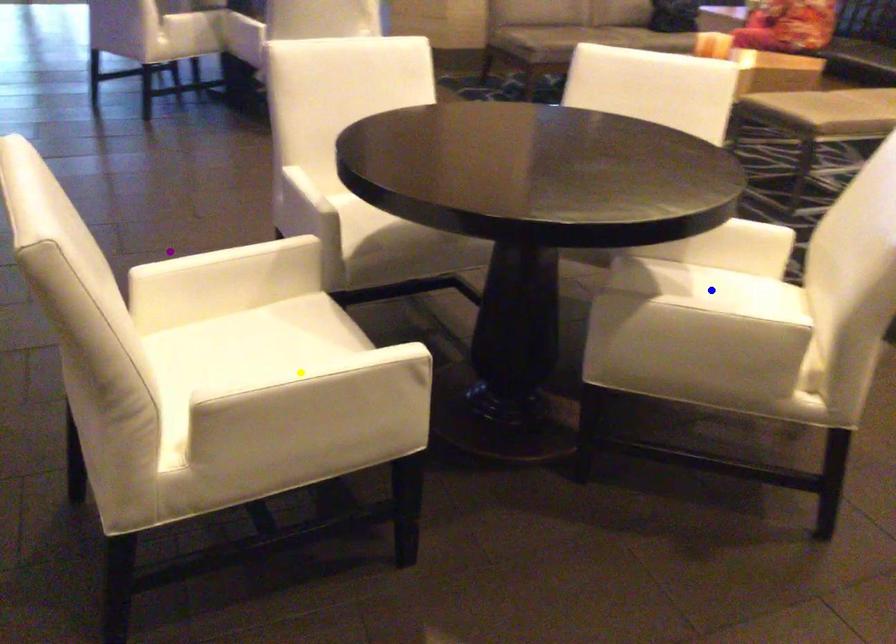
Order these from nearest to farthest:
purple point
blue point
yellow point

yellow point → blue point → purple point